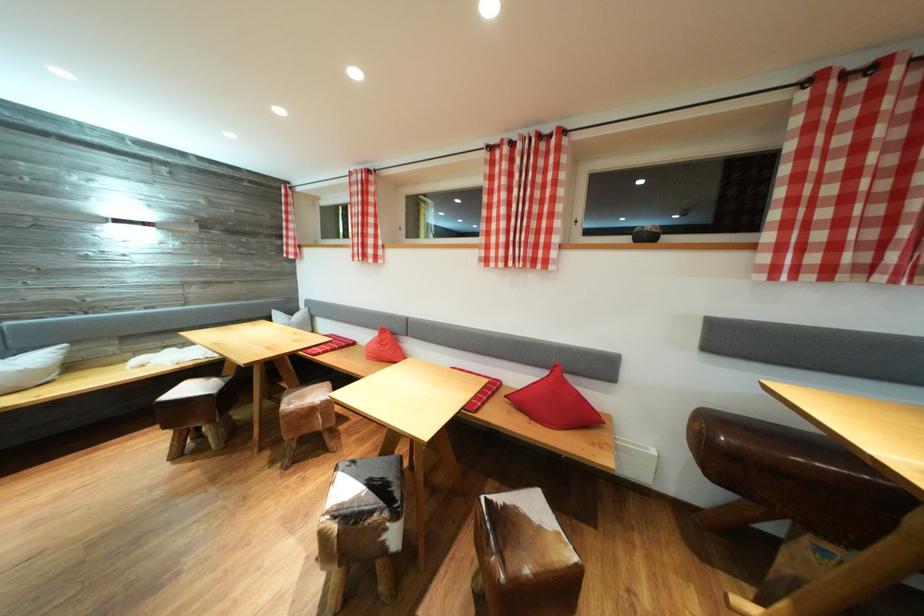
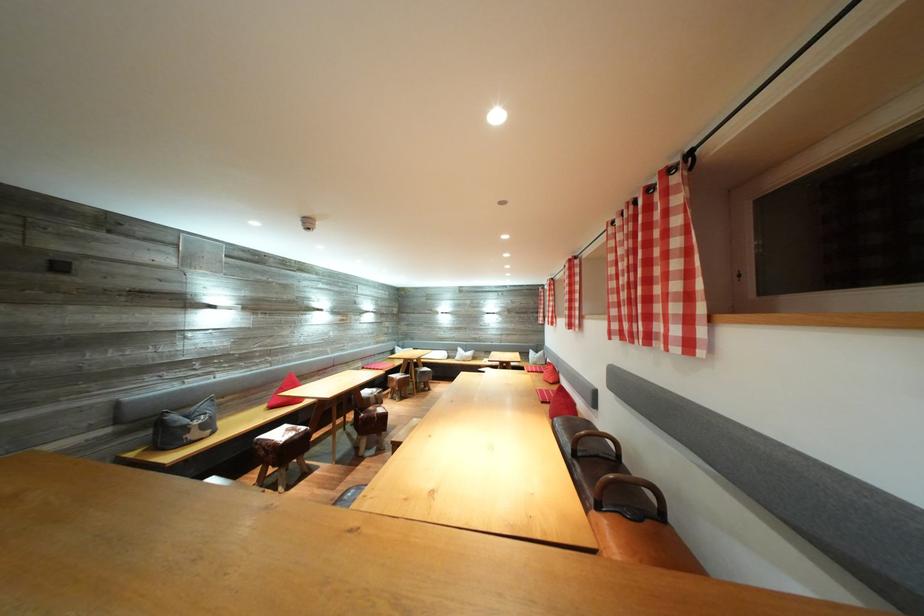
In the second image, find the point that corresponds to (326,182) in the first image.

(553, 288)